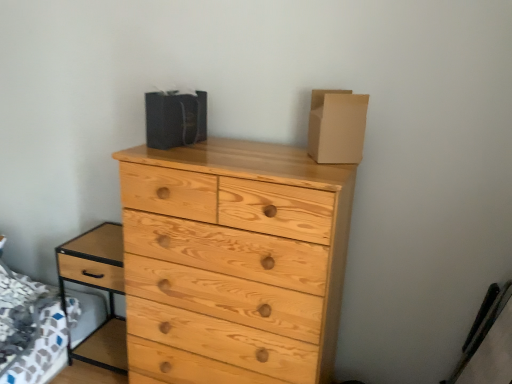
Image resolution: width=512 pixels, height=384 pixels. In order to click on natural wood chest of drawers at center in this screenshot , I will do coord(233,262).

Locate an element on the screen. This screenshot has width=512, height=384. brown cardboard box at upper right, which appears as the 1th cardboard box when viewed from the right is located at coordinates (337, 126).

Is brown cardboard box at upper right, which appears as the 1th cardboard box when viewed from the right, inside the boundaries of matte black bag at upper center, the second cardboard box positioned from the right, or outside?

brown cardboard box at upper right, which appears as the 1th cardboard box when viewed from the right, is not inside matte black bag at upper center, the second cardboard box positioned from the right, it's outside.

Which point is more forward, [338,147] or [152,98]?

The point [338,147] is more forward.

Locate an element on the screen. Image resolution: width=512 pixels, height=384 pixels. cardboard box below the brown cardboard box at upper right, the second cardboard box viewed from the left (from a real-world perspective) is located at coordinates (175, 119).

Is the surface of brown cardboard box at upper right, which appears as the 1th cardboard box when viewed from the right, in direct contact with matte black bag at upper center, the second cardboard box positioned from the right?

brown cardboard box at upper right, which appears as the 1th cardboard box when viewed from the right, and matte black bag at upper center, the second cardboard box positioned from the right, are not in contact.

Between natural wood chest of drawers at center and brown cardboard box at upper right, which appears as the 1th cardboard box when viewed from the right, which one appears on the right side from the viewer's perspective?

brown cardboard box at upper right, which appears as the 1th cardboard box when viewed from the right, is more to the right.

Is natural wood chest of drawers at center aimed at brown cardboard box at upper right, which appears as the 1th cardboard box when viewed from the right?

No, natural wood chest of drawers at center is not aimed at brown cardboard box at upper right, which appears as the 1th cardboard box when viewed from the right.

From a real-world perspective, is natural wood chest of drawers at center positioned over brown cardboard box at upper right, the second cardboard box viewed from the left, based on gravity?

Actually, natural wood chest of drawers at center is physically below brown cardboard box at upper right, the second cardboard box viewed from the left, in the real world.

Do you think natural wood chest of drawers at center is within brown cardboard box at upper right, which appears as the 1th cardboard box when viewed from the right, or outside of it?

natural wood chest of drawers at center is outside brown cardboard box at upper right, which appears as the 1th cardboard box when viewed from the right.

Does point (110, 306) lie behind point (198, 333)?

Yes.

Looking at this image, from a real-world perspective, between light brown wood nightstand at lower left and natural wood chest of drawers at center, who is vertically lower?

light brown wood nightstand at lower left.

Does light brown wood nightstand at lower left touch natural wood chest of drawers at center?

No, light brown wood nightstand at lower left is not touching natural wood chest of drawers at center.

Can you confirm if light brown wood nightstand at lower left is taller than natural wood chest of drawers at center?

In fact, light brown wood nightstand at lower left may be shorter than natural wood chest of drawers at center.

Considering the relative positions of brown cardboard box at upper right, the second cardboard box viewed from the left, and light brown wood nightstand at lower left in the image provided, is brown cardboard box at upper right, the second cardboard box viewed from the left, to the right of light brown wood nightstand at lower left from the viewer's perspective?

Indeed, brown cardboard box at upper right, the second cardboard box viewed from the left, is positioned on the right side of light brown wood nightstand at lower left.

Looking at this image, from the image's perspective, is brown cardboard box at upper right, the second cardboard box viewed from the left, above or below light brown wood nightstand at lower left?

Clearly, from the image's perspective, brown cardboard box at upper right, the second cardboard box viewed from the left, is above light brown wood nightstand at lower left.

Is brown cardboard box at upper right, which appears as the 1th cardboard box when viewed from the right, turned away from light brown wood nightstand at lower left?

No, brown cardboard box at upper right, which appears as the 1th cardboard box when viewed from the right, is not facing the opposite direction of light brown wood nightstand at lower left.

From a real-world perspective, does brown cardboard box at upper right, the second cardboard box viewed from the left, stand above light brown wood nightstand at lower left?

Correct, in the physical world, brown cardboard box at upper right, the second cardboard box viewed from the left, is higher than light brown wood nightstand at lower left.

From the image's perspective, is natural wood chest of drawers at center on matte black bag at upper center, the second cardboard box positioned from the right?

No, from the image's perspective, natural wood chest of drawers at center is not over matte black bag at upper center, the second cardboard box positioned from the right.

How far apart are natural wood chest of drawers at center and matte black bag at upper center, positioned as the 1th cardboard box in left-to-right order?

They are 17.51 inches apart.

Would you consider natural wood chest of drawers at center to be distant from matte black bag at upper center, positioned as the 1th cardboard box in left-to-right order?

natural wood chest of drawers at center is actually quite close to matte black bag at upper center, positioned as the 1th cardboard box in left-to-right order.

Between natural wood chest of drawers at center and matte black bag at upper center, the second cardboard box positioned from the right, which one appears on the right side from the viewer's perspective?

natural wood chest of drawers at center is more to the right.

Is matte black bag at upper center, positioned as the 1th cardboard box in left-to-right order, to the left or to the right of light brown wood nightstand at lower left in the image?

In the image, matte black bag at upper center, positioned as the 1th cardboard box in left-to-right order, appears on the right side of light brown wood nightstand at lower left.

From the image's perspective, starting from the light brown wood nightstand at lower left, which cardboard box is the 2nd one above? Please provide its 2D coordinates.

[(175, 119)]

From the image's perspective, relative to light brown wood nightstand at lower left, is matte black bag at upper center, the second cardboard box positioned from the right, above or below?

From the image's perspective, matte black bag at upper center, the second cardboard box positioned from the right, appears above light brown wood nightstand at lower left.

Can you confirm if matte black bag at upper center, positioned as the 1th cardboard box in left-to-right order, is smaller than light brown wood nightstand at lower left?

Yes.

Is matte black bag at upper center, the second cardboard box positioned from the right, inside light brown wood nightstand at lower left?

No, matte black bag at upper center, the second cardboard box positioned from the right, is not a part of light brown wood nightstand at lower left.

Based on the photo, is light brown wood nightstand at lower left in front of or behind matte black bag at upper center, the second cardboard box positioned from the right, in the image?

light brown wood nightstand at lower left is behind matte black bag at upper center, the second cardboard box positioned from the right.

Which of these two, light brown wood nightstand at lower left or matte black bag at upper center, positioned as the 1th cardboard box in left-to-right order, is wider?

light brown wood nightstand at lower left is wider.

From the image's perspective, is light brown wood nightstand at lower left above or below matte black bag at upper center, positioned as the 1th cardboard box in left-to-right order?

light brown wood nightstand at lower left is situated lower than matte black bag at upper center, positioned as the 1th cardboard box in left-to-right order, in the image.

Locate an element on the screen. The image size is (512, 384). cardboard box on the right of matte black bag at upper center, positioned as the 1th cardboard box in left-to-right order is located at coordinates (337, 126).

Locate an element on the screen. The width and height of the screenshot is (512, 384). the chest of drawers located below the brown cardboard box at upper right, the second cardboard box viewed from the left (from the image's perspective) is located at coordinates (233, 262).

Considering their positions, is matte black bag at upper center, positioned as the 1th cardboard box in left-to-right order, positioned closer to brown cardboard box at upper right, which appears as the 1th cardboard box when viewed from the right, than light brown wood nightstand at lower left?

matte black bag at upper center, positioned as the 1th cardboard box in left-to-right order, is closer to brown cardboard box at upper right, which appears as the 1th cardboard box when viewed from the right.

Which object lies further to the anchor point light brown wood nightstand at lower left, natural wood chest of drawers at center or brown cardboard box at upper right, which appears as the 1th cardboard box when viewed from the right?

brown cardboard box at upper right, which appears as the 1th cardboard box when viewed from the right, is further to light brown wood nightstand at lower left.

Consider the image. Based on their spatial positions, is matte black bag at upper center, positioned as the 1th cardboard box in left-to-right order, or light brown wood nightstand at lower left further from natural wood chest of drawers at center?

Based on the image, light brown wood nightstand at lower left appears to be further to natural wood chest of drawers at center.

Estimate the real-world distances between objects in this image. Which object is closer to matte black bag at upper center, the second cardboard box positioned from the right, brown cardboard box at upper right, which appears as the 1th cardboard box when viewed from the right, or light brown wood nightstand at lower left?

brown cardboard box at upper right, which appears as the 1th cardboard box when viewed from the right, is positioned closer to the anchor matte black bag at upper center, the second cardboard box positioned from the right.

When comparing their distances from light brown wood nightstand at lower left, does natural wood chest of drawers at center or matte black bag at upper center, the second cardboard box positioned from the right, seem further?

Based on the image, matte black bag at upper center, the second cardboard box positioned from the right, appears to be further to light brown wood nightstand at lower left.

In the scene shown: Which object lies nearer to the anchor point natural wood chest of drawers at center, light brown wood nightstand at lower left or brown cardboard box at upper right, the second cardboard box viewed from the left?

Based on the image, brown cardboard box at upper right, the second cardboard box viewed from the left, appears to be nearer to natural wood chest of drawers at center.

Which object lies further to the anchor point light brown wood nightstand at lower left, matte black bag at upper center, the second cardboard box positioned from the right, or brown cardboard box at upper right, which appears as the 1th cardboard box when viewed from the right?

Based on the image, brown cardboard box at upper right, which appears as the 1th cardboard box when viewed from the right, appears to be further to light brown wood nightstand at lower left.

Considering their positions, is light brown wood nightstand at lower left positioned closer to brown cardboard box at upper right, which appears as the 1th cardboard box when viewed from the right, than natural wood chest of drawers at center?

natural wood chest of drawers at center lies closer to brown cardboard box at upper right, which appears as the 1th cardboard box when viewed from the right, than the other object.

You are a GUI agent. You are given a task and a screenshot of the screen. Output one action in this format:
    pyautogui.click(x=<x>, y=<y>)
    Task: Click on the chest of drawers between light brown wood nightstand at lower left and brown cardboard box at upper right, the second cardboard box viewed from the left
    The width and height of the screenshot is (512, 384).
    Given the screenshot: What is the action you would take?
    pyautogui.click(x=233, y=262)

At what (x,y) coordinates should I click in order to perform the action: click on cardboard box between matte black bag at upper center, positioned as the 1th cardboard box in left-to-right order, and natural wood chest of drawers at center vertically. Please return your answer as a coordinate pair (x, y). Looking at the image, I should click on (337, 126).

Where is `the chest of drawers that lies between matte black bag at upper center, positioned as the 1th cardboard box in left-to-right order, and light brown wood nightstand at lower left from top to bottom`? the chest of drawers that lies between matte black bag at upper center, positioned as the 1th cardboard box in left-to-right order, and light brown wood nightstand at lower left from top to bottom is located at coordinates (233, 262).

This screenshot has height=384, width=512. I want to click on cardboard box situated between light brown wood nightstand at lower left and brown cardboard box at upper right, which appears as the 1th cardboard box when viewed from the right, from left to right, so click(x=175, y=119).